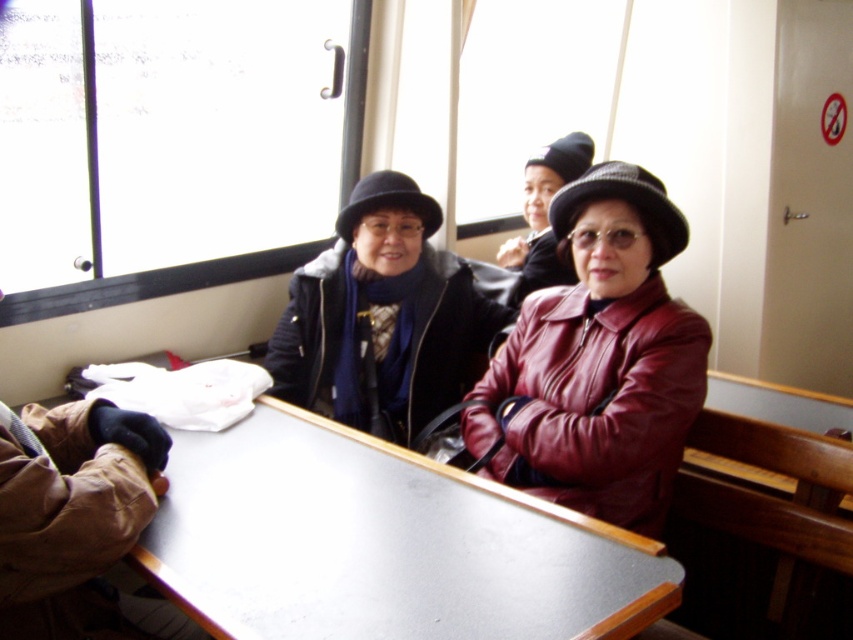
Question: Can you confirm if smooth gray table at center is positioned to the right of leather jacket at center?

Choices:
 (A) no
 (B) yes

Answer: (A)

Question: Which point appears farthest from the camera in this image?

Choices:
 (A) (607, 316)
 (B) (341, 632)

Answer: (A)

Question: Can you confirm if smooth gray table at center is positioned to the left of leather jacket at center?

Choices:
 (A) yes
 (B) no

Answer: (A)

Question: Does smooth gray table at center have a larger size compared to leather jacket at center?

Choices:
 (A) yes
 (B) no

Answer: (A)

Question: Among these objects, which one is farthest from the camera?

Choices:
 (A) leather jacket at center
 (B) smooth gray table at center

Answer: (A)

Question: Among these objects, which one is nearest to the camera?

Choices:
 (A) smooth gray table at center
 (B) leather jacket at center

Answer: (A)